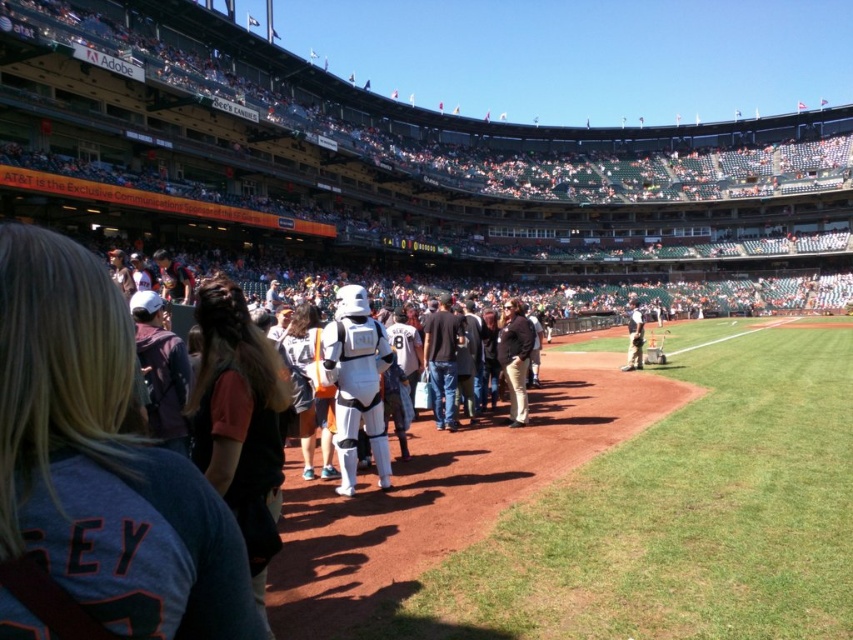
You are a photographer at the baseball stadium and want to capture a photo of both the dark brown leather jacket at center and the white plastic helmet at center. Which object should you focus on first if you want to ensure both are in the frame without moving the camera?

The dark brown leather jacket at center is much taller than the white plastic helmet at center, so you should focus on the taller dark brown leather jacket at center first to ensure both are in the frame.

You are standing at the entrance of the baseball stadium and see the point at coordinates (x=357, y=384). What object is located at that point?

The point at (x=357, y=384) corresponds to the white plastic stormtrooper at center.